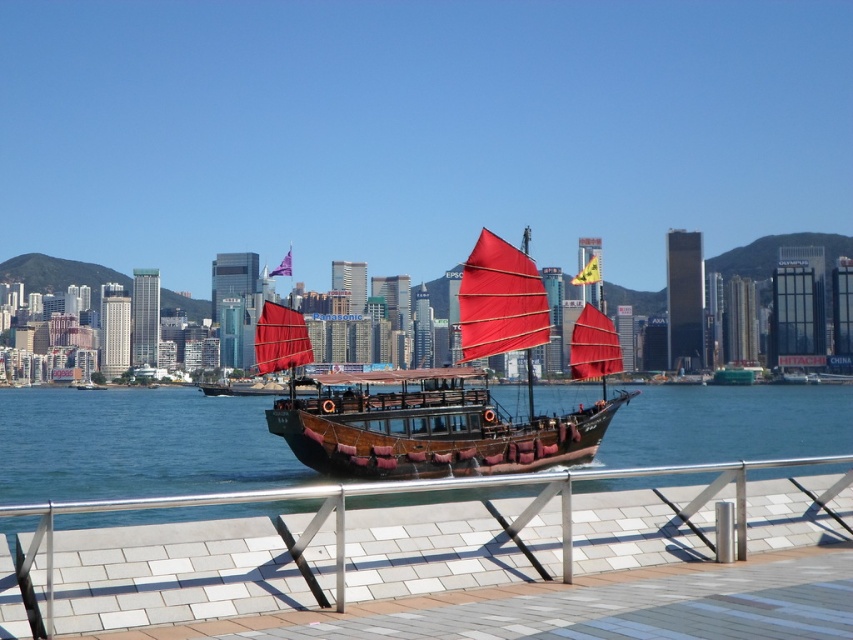
Question: Which object is positioned closest to the transparent blue water at center?

Choices:
 (A) wooden boat at center
 (B) white tile dock at lower center

Answer: (A)

Question: Does white tile dock at lower center have a smaller size compared to transparent blue water at center?

Choices:
 (A) yes
 (B) no

Answer: (A)

Question: Which object is positioned closest to the wooden boat at center?

Choices:
 (A) white tile dock at lower center
 (B) transparent blue water at center

Answer: (A)

Question: Is transparent blue water at center above wooden boat at center?

Choices:
 (A) no
 (B) yes

Answer: (A)

Question: Can you confirm if white tile dock at lower center is wider than transparent blue water at center?

Choices:
 (A) yes
 (B) no

Answer: (B)

Question: Among these points, which one is farthest from the camera?

Choices:
 (A) (770, 433)
 (B) (369, 417)
 (C) (790, 508)

Answer: (A)